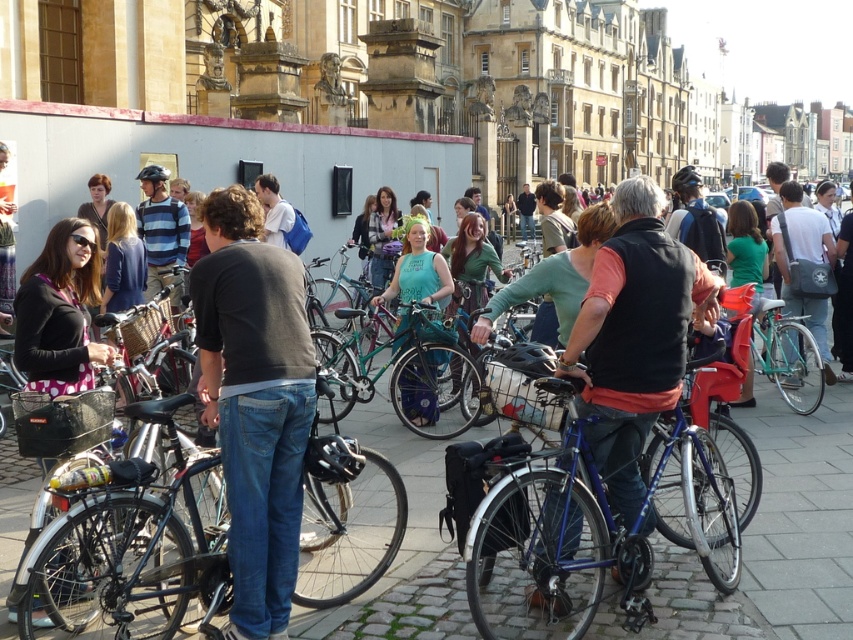
Question: Estimate the real-world distances between objects in this image. Which object is farther from the shiny blue frame at center?

Choices:
 (A) blue metallic bicycle at center
 (B) cobblestone pavement at center
 (C) dark gray cotton shirt at center
 (D) shiny metallic bicycle at center

Answer: (C)

Question: Which is nearer to the dark gray cotton shirt at center?

Choices:
 (A) green matte bicycle at center
 (B) cobblestone pavement at center

Answer: (B)

Question: Is blue metallic bicycle at center positioned at the back of green matte bicycle at center?

Choices:
 (A) no
 (B) yes

Answer: (A)

Question: Is cobblestone pavement at center wider than dark gray cotton shirt at center?

Choices:
 (A) no
 (B) yes

Answer: (B)

Question: Which object is closer to the camera taking this photo?

Choices:
 (A) shiny metallic bicycle at center
 (B) dark gray cotton shirt at center

Answer: (A)

Question: Can you confirm if shiny metallic bicycle at center is bigger than green matte bicycle at center?

Choices:
 (A) yes
 (B) no

Answer: (A)